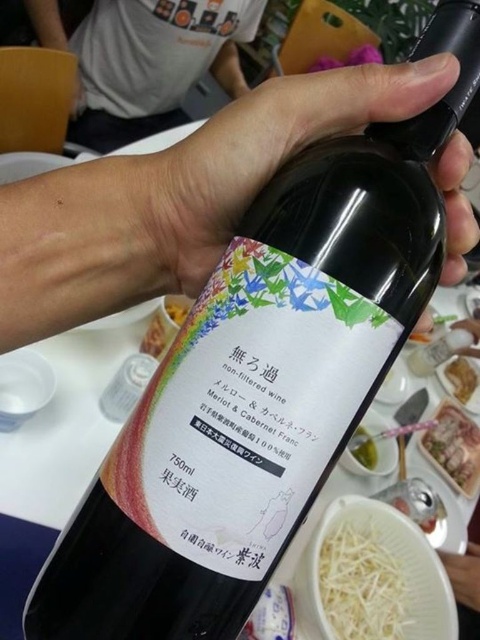
Question: Based on their relative distances, which object is farther from the matte white t-shirt at upper center?

Choices:
 (A) translucent plastic container at lower right
 (B) green leafy vegetable at bottle right

Answer: (B)

Question: Is translucent plastic container at lower right bigger than yellow crumbly cheese at bottle right?

Choices:
 (A) yes
 (B) no

Answer: (A)

Question: Considering the relative positions of matte white t-shirt at upper center and yellow crumbly cheese at bottle right in the image provided, where is matte white t-shirt at upper center located with respect to yellow crumbly cheese at bottle right?

Choices:
 (A) right
 (B) left

Answer: (B)

Question: Among these objects, which one is farthest from the camera?

Choices:
 (A) green leafy vegetable at bottle right
 (B) yellow crumbly cheese at bottle right

Answer: (A)

Question: Does white stringy food at lower center appear on the right side of yellow crumbly cheese at bottle right?

Choices:
 (A) yes
 (B) no

Answer: (A)

Question: Which object is the farthest from the matte white t-shirt at upper center?

Choices:
 (A) yellow crumbly cheese at bottle right
 (B) matte black wine bottle at center
 (C) white paper plate at lower center
 (D) green leafy vegetable at bottle right

Answer: (B)